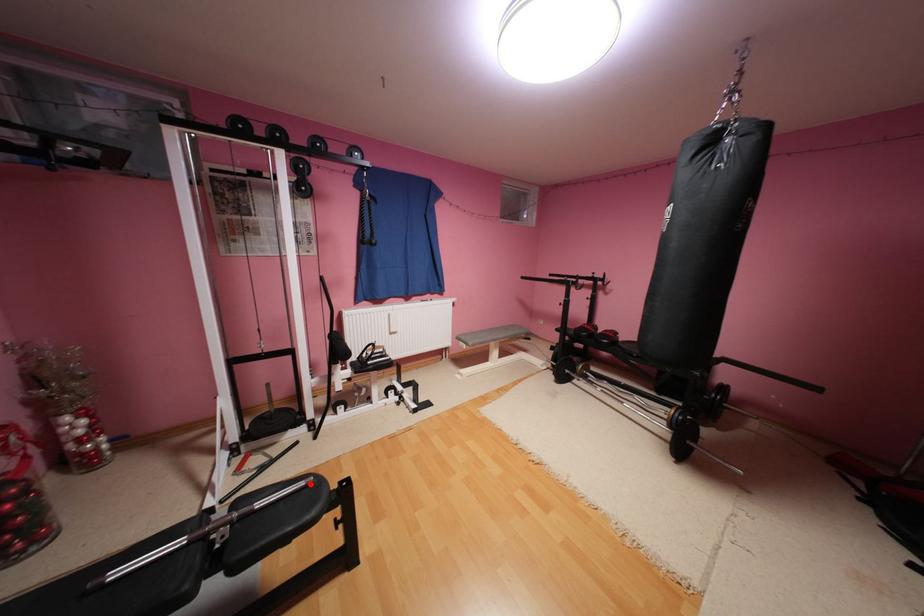
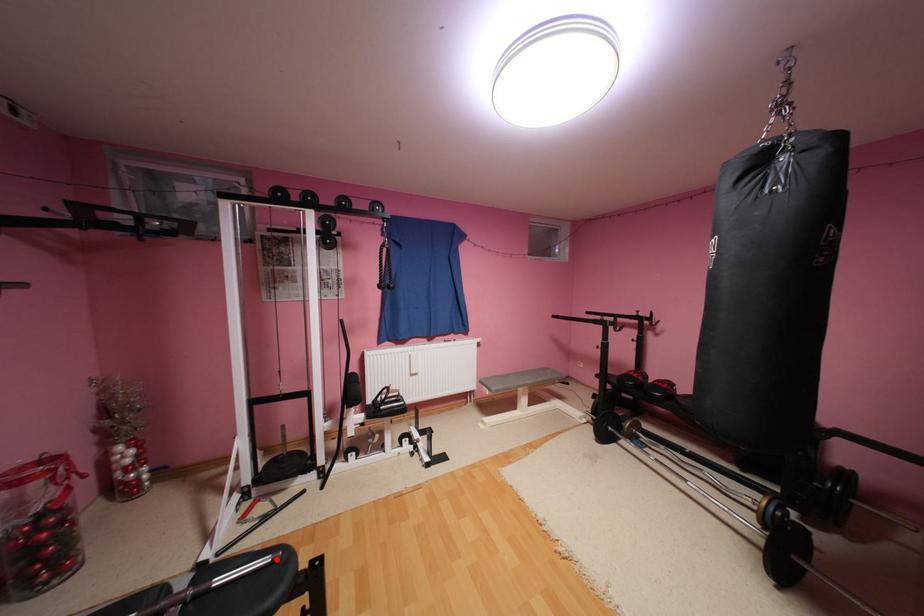
I am providing you with two images of the same scene from different viewpoints. A red point is marked on the first image and another point is marked on the second image. Are the points marked in image1 and image2 representing the same 3D position?

Yes